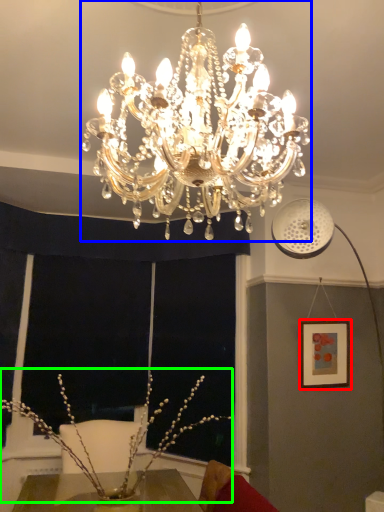
Question: Estimate the real-world distances between objects in this image. Which object is closer to picture frame (highlighted by a red box), lamp (highlighted by a blue box) or floral arrangement (highlighted by a green box)?

Choices:
 (A) lamp
 (B) floral arrangement

Answer: (B)